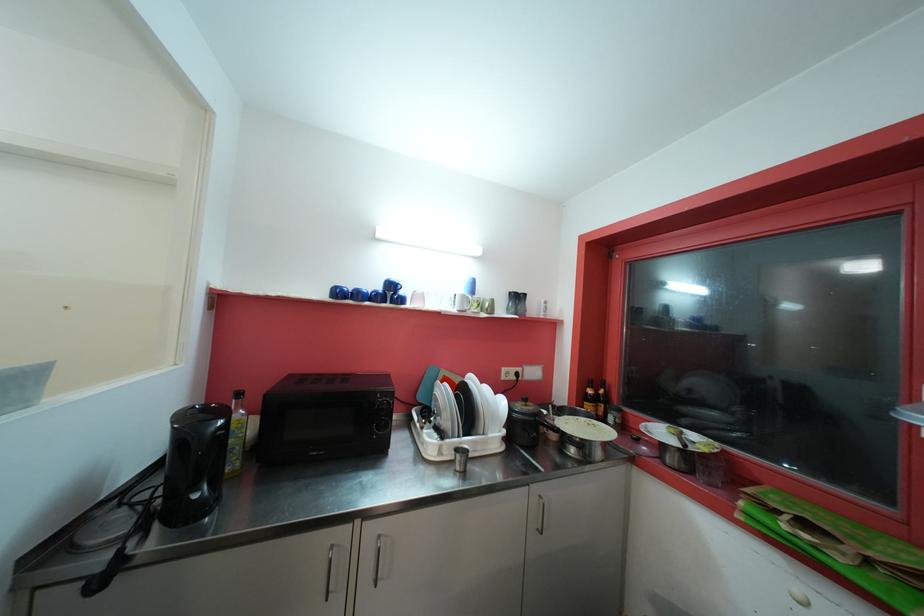
Describe the element at coordinates (467, 302) in the screenshot. This screenshot has width=924, height=616. I see `the white mug handle` at that location.